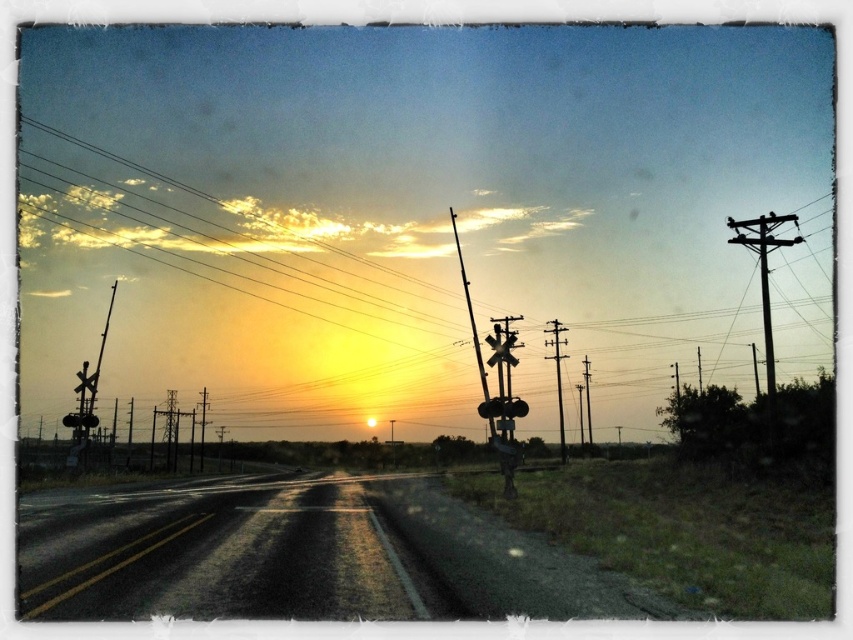
Can you confirm if smooth wood telegraph pole at center right is positioned to the right of metallic traffic light at center?

Indeed, smooth wood telegraph pole at center right is positioned on the right side of metallic traffic light at center.

Is point (548, 324) farther from camera compared to point (498, 403)?

Yes, it is behind point (498, 403).

Who is more forward, [560,376] or [521,410]?

Point [521,410] is more forward.

Locate an element on the screen. The width and height of the screenshot is (853, 640). smooth wood telegraph pole at center right is located at coordinates (556, 374).

Does silhouette wooden pole at right have a smaller size compared to smooth wood telegraph pole at center right?

Incorrect, silhouette wooden pole at right is not smaller in size than smooth wood telegraph pole at center right.

Which of these two, silhouette wooden pole at right or smooth wood telegraph pole at center right, stands taller?

silhouette wooden pole at right

Locate an element on the screen. silhouette wooden pole at right is located at coordinates (764, 273).

Locate an element on the screen. This screenshot has width=853, height=640. silhouette wooden pole at right is located at coordinates (764, 273).

Between black asphalt road at center and metallic traffic light at center, which one has less height?

Standing shorter between the two is metallic traffic light at center.

Which of these two, black asphalt road at center or metallic traffic light at center, stands taller?

black asphalt road at center

Locate an element on the screen. black asphalt road at center is located at coordinates (221, 554).